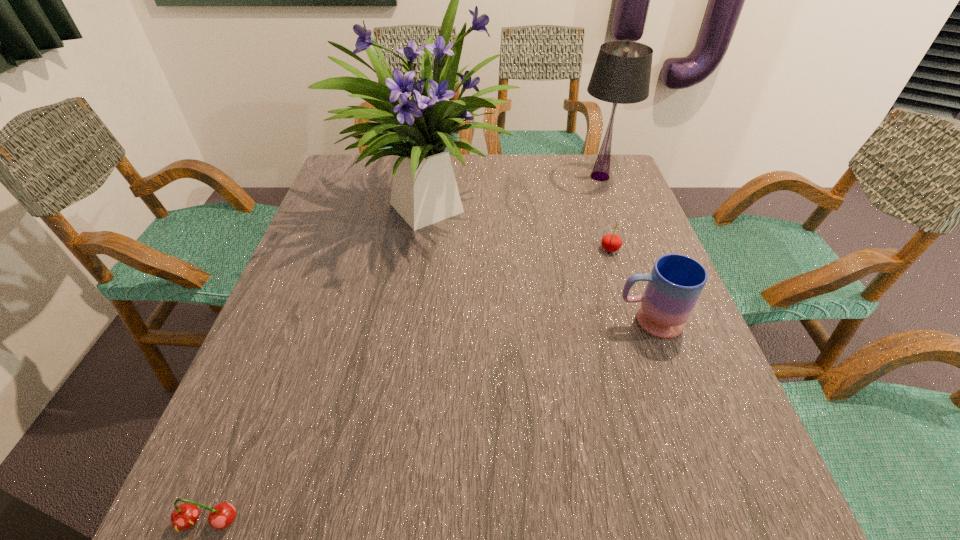
At what (x,y) coordinates should I click in order to perform the action: click on lampshade that is at the right edge. Please return your answer as a coordinate pair (x, y). This screenshot has width=960, height=540. Looking at the image, I should click on (621, 75).

Locate an element on the screen. The image size is (960, 540). mug present at the right edge is located at coordinates (676, 281).

This screenshot has width=960, height=540. Find the location of `cherry situated at the right edge`. cherry situated at the right edge is located at coordinates (610, 242).

At what (x,y) coordinates should I click in order to perform the action: click on object at the far left corner. Please return your answer as a coordinate pair (x, y). The image size is (960, 540). Looking at the image, I should click on (424, 191).

The width and height of the screenshot is (960, 540). In order to click on object present at the near left corner in this screenshot , I will do `click(184, 516)`.

You are a GUI agent. You are given a task and a screenshot of the screen. Output one action in this format:
    pyautogui.click(x=<x>, y=<y>)
    Task: Click on the object present at the far right corner
    This screenshot has width=960, height=540.
    Given the screenshot: What is the action you would take?
    pyautogui.click(x=621, y=75)

Where is `vacant region at the far edge of the desktop`? vacant region at the far edge of the desktop is located at coordinates (390, 197).

Locate an element on the screen. Image resolution: width=960 pixels, height=540 pixels. free space at the left edge of the desktop is located at coordinates (307, 244).

In the image, there is a desktop. Where is `free space at the right edge`? Image resolution: width=960 pixels, height=540 pixels. free space at the right edge is located at coordinates click(x=586, y=221).

Where is `vacant space at the far left corner of the desktop`? This screenshot has height=540, width=960. vacant space at the far left corner of the desktop is located at coordinates (361, 171).